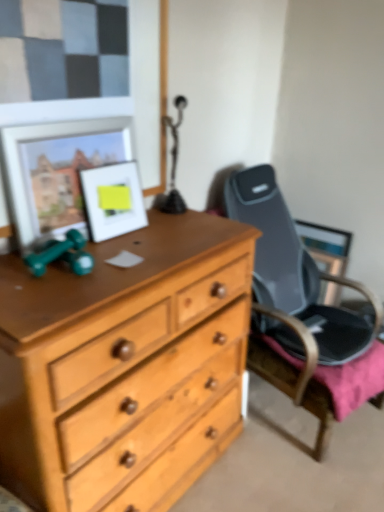
This screenshot has height=512, width=384. What do you see at coordinates (112, 200) in the screenshot? I see `matte white picture frame at upper left, marked as the 1th picture frame in a right-to-left arrangement` at bounding box center [112, 200].

Find the location of a particular element. This screenshot has width=384, height=512. matte white picture frame at upper left, which is the second picture frame in left-to-right order is located at coordinates (112, 200).

How much space does matte white picture frame at upper left, which is the second picture frame in left-to-right order, occupy horizontally?

matte white picture frame at upper left, which is the second picture frame in left-to-right order, is 7.68 centimeters wide.

Find the location of a particular element. matte silver picture frame at upper left, the second picture frame when ordered from right to left is located at coordinates (57, 170).

What do you see at coordinates (57, 170) in the screenshot? Image resolution: width=384 pixels, height=512 pixels. I see `matte silver picture frame at upper left, the second picture frame when ordered from right to left` at bounding box center [57, 170].

Locate an element on the screen. The width and height of the screenshot is (384, 512). matte white picture frame at upper left, marked as the 1th picture frame in a right-to-left arrangement is located at coordinates (112, 200).

Can you confirm if matte silver picture frame at upper left, the second picture frame when ordered from right to left, is positioned to the right of matte white picture frame at upper left, marked as the 1th picture frame in a right-to-left arrangement?

No, matte silver picture frame at upper left, the second picture frame when ordered from right to left, is not to the right of matte white picture frame at upper left, marked as the 1th picture frame in a right-to-left arrangement.

Which object is more forward, matte silver picture frame at upper left, which is the 1th picture frame in left-to-right order, or matte white picture frame at upper left, which is the second picture frame in left-to-right order?

matte silver picture frame at upper left, which is the 1th picture frame in left-to-right order.

Which is closer, (81,199) or (108,204)?

Point (81,199) is positioned closer to the camera compared to point (108,204).

From the image's perspective, between matte silver picture frame at upper left, which is the 1th picture frame in left-to-right order, and matte white picture frame at upper left, marked as the 1th picture frame in a right-to-left arrangement, which one is located above?

From the image's view, matte silver picture frame at upper left, which is the 1th picture frame in left-to-right order, is above.

From a real-world perspective, is matte silver picture frame at upper left, the second picture frame when ordered from right to left, physically located above or below matte white picture frame at upper left, marked as the 1th picture frame in a right-to-left arrangement?

Clearly, from a real-world perspective, matte silver picture frame at upper left, the second picture frame when ordered from right to left, is above matte white picture frame at upper left, marked as the 1th picture frame in a right-to-left arrangement.

Considering the sizes of objects matte silver picture frame at upper left, the second picture frame when ordered from right to left, and matte white picture frame at upper left, marked as the 1th picture frame in a right-to-left arrangement, in the image provided, who is wider, matte silver picture frame at upper left, the second picture frame when ordered from right to left, or matte white picture frame at upper left, marked as the 1th picture frame in a right-to-left arrangement,?

matte white picture frame at upper left, marked as the 1th picture frame in a right-to-left arrangement.

Considering the sizes of objects matte silver picture frame at upper left, which is the 1th picture frame in left-to-right order, and matte white picture frame at upper left, which is the second picture frame in left-to-right order, in the image provided, who is shorter, matte silver picture frame at upper left, which is the 1th picture frame in left-to-right order, or matte white picture frame at upper left, which is the second picture frame in left-to-right order,?

Standing shorter between the two is matte white picture frame at upper left, which is the second picture frame in left-to-right order.

Considering the sizes of objects matte silver picture frame at upper left, the second picture frame when ordered from right to left, and matte white picture frame at upper left, marked as the 1th picture frame in a right-to-left arrangement, in the image provided, who is bigger, matte silver picture frame at upper left, the second picture frame when ordered from right to left, or matte white picture frame at upper left, marked as the 1th picture frame in a right-to-left arrangement,?

With larger size is matte silver picture frame at upper left, the second picture frame when ordered from right to left.

Does matte silver picture frame at upper left, which is the 1th picture frame in left-to-right order, contain matte white picture frame at upper left, marked as the 1th picture frame in a right-to-left arrangement?

Yes, matte white picture frame at upper left, marked as the 1th picture frame in a right-to-left arrangement, is a part of matte silver picture frame at upper left, which is the 1th picture frame in left-to-right order.

Can you see matte silver picture frame at upper left, the second picture frame when ordered from right to left, touching matte white picture frame at upper left, which is the second picture frame in left-to-right order?

No, matte silver picture frame at upper left, the second picture frame when ordered from right to left, is not in contact with matte white picture frame at upper left, which is the second picture frame in left-to-right order.

In the scene shown: Is matte silver picture frame at upper left, which is the 1th picture frame in left-to-right order, oriented away from matte white picture frame at upper left, marked as the 1th picture frame in a right-to-left arrangement?

Yes.

From the picture: Can you tell me how much matte silver picture frame at upper left, the second picture frame when ordered from right to left, and matte white picture frame at upper left, marked as the 1th picture frame in a right-to-left arrangement, differ in facing direction?

0.00466 degrees separate the facing orientations of matte silver picture frame at upper left, the second picture frame when ordered from right to left, and matte white picture frame at upper left, marked as the 1th picture frame in a right-to-left arrangement.

Find the location of `picture frame on the right of matte silver picture frame at upper left, the second picture frame when ordered from right to left`. picture frame on the right of matte silver picture frame at upper left, the second picture frame when ordered from right to left is located at coordinates (112, 200).

Consider the image. Which is more to the right, matte white picture frame at upper left, marked as the 1th picture frame in a right-to-left arrangement, or matte silver picture frame at upper left, which is the 1th picture frame in left-to-right order?

matte white picture frame at upper left, marked as the 1th picture frame in a right-to-left arrangement.

Does matte white picture frame at upper left, which is the second picture frame in left-to-right order, come behind matte silver picture frame at upper left, the second picture frame when ordered from right to left?

Yes, matte white picture frame at upper left, which is the second picture frame in left-to-right order, is further from the camera.

Which is further, (123, 182) or (11, 133)?

The point (123, 182) is farther from the camera.

From the image's perspective, between matte white picture frame at upper left, marked as the 1th picture frame in a right-to-left arrangement, and matte silver picture frame at upper left, the second picture frame when ordered from right to left, who is located below?

matte white picture frame at upper left, marked as the 1th picture frame in a right-to-left arrangement, appears lower in the image.

From a real-world perspective, which object stands above the other?

In real-world perspective, matte silver picture frame at upper left, the second picture frame when ordered from right to left, is above.

Is matte white picture frame at upper left, marked as the 1th picture frame in a right-to-left arrangement, wider or thinner than matte silver picture frame at upper left, which is the 1th picture frame in left-to-right order?

matte white picture frame at upper left, marked as the 1th picture frame in a right-to-left arrangement, is wider than matte silver picture frame at upper left, which is the 1th picture frame in left-to-right order.

Is matte white picture frame at upper left, marked as the 1th picture frame in a right-to-left arrangement, shorter than matte silver picture frame at upper left, the second picture frame when ordered from right to left?

Yes, matte white picture frame at upper left, marked as the 1th picture frame in a right-to-left arrangement, is shorter than matte silver picture frame at upper left, the second picture frame when ordered from right to left.

Looking at the image, does matte white picture frame at upper left, marked as the 1th picture frame in a right-to-left arrangement, seem bigger or smaller compared to matte silver picture frame at upper left, the second picture frame when ordered from right to left?

Considering their sizes, matte white picture frame at upper left, marked as the 1th picture frame in a right-to-left arrangement, takes up less space than matte silver picture frame at upper left, the second picture frame when ordered from right to left.

Is matte white picture frame at upper left, which is the second picture frame in left-to-right order, outside of matte silver picture frame at upper left, the second picture frame when ordered from right to left?

No, matte white picture frame at upper left, which is the second picture frame in left-to-right order, is not entirely external to matte silver picture frame at upper left, the second picture frame when ordered from right to left.

Would you say matte white picture frame at upper left, which is the second picture frame in left-to-right order, is a long distance from matte silver picture frame at upper left, which is the 1th picture frame in left-to-right order?

They are positioned close to each other.

Is matte white picture frame at upper left, marked as the 1th picture frame in a right-to-left arrangement, aimed at matte silver picture frame at upper left, the second picture frame when ordered from right to left?

No, matte white picture frame at upper left, marked as the 1th picture frame in a right-to-left arrangement, is not facing towards matte silver picture frame at upper left, the second picture frame when ordered from right to left.

Locate an element on the screen. This screenshot has height=512, width=384. picture frame above the matte white picture frame at upper left, marked as the 1th picture frame in a right-to-left arrangement (from the image's perspective) is located at coordinates (57, 170).

Locate an element on the screen. picture frame that appears on the left of matte white picture frame at upper left, marked as the 1th picture frame in a right-to-left arrangement is located at coordinates (57, 170).

Find the location of a particular element. This screenshot has width=384, height=512. picture frame that appears below the matte silver picture frame at upper left, which is the 1th picture frame in left-to-right order (from a real-world perspective) is located at coordinates (112, 200).